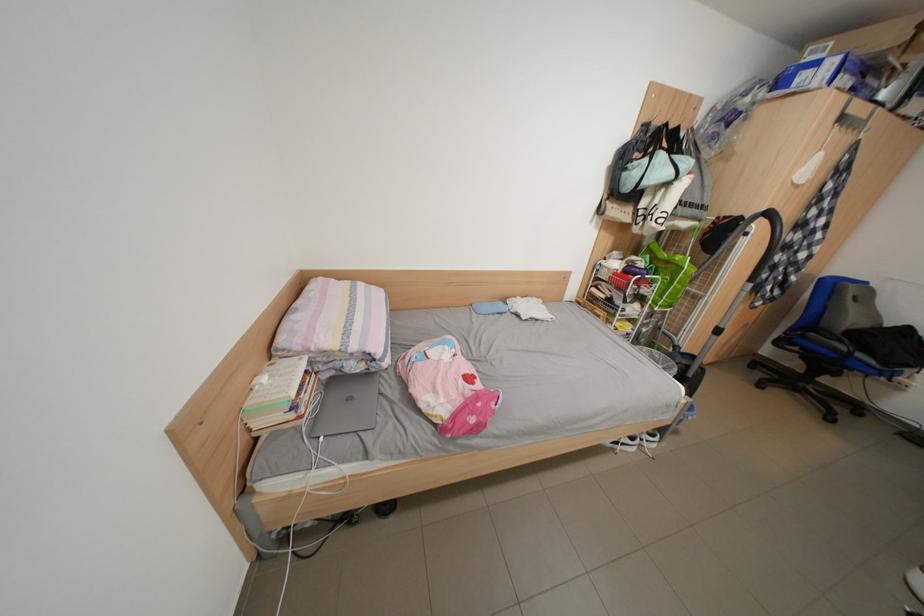
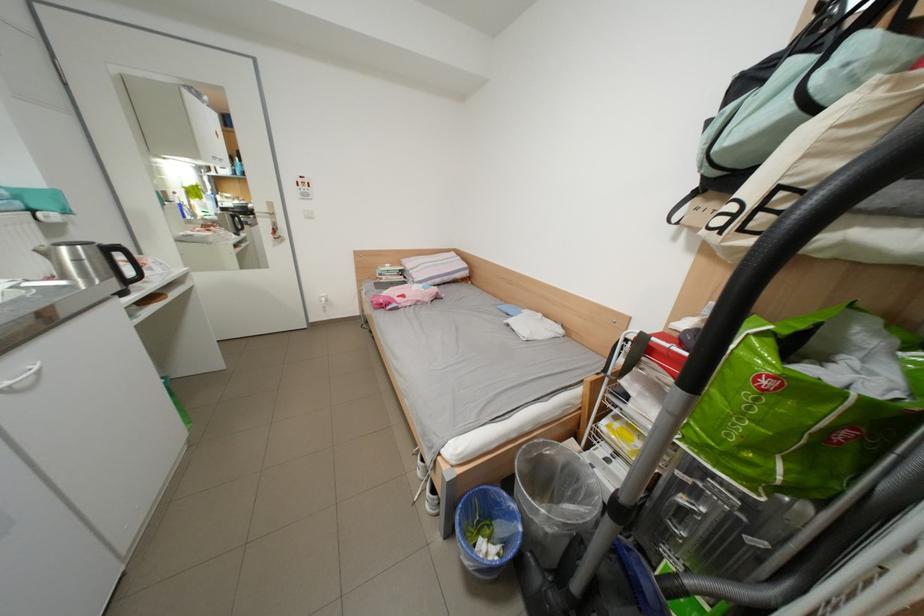
In the second image, find the point that corresponds to the point at 685,227 in the first image.

(856, 245)